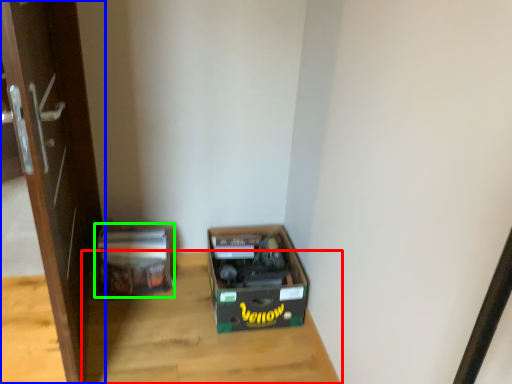
Question: Which object is positioned closest to table (highlighted by a red box)? Select from door (highlighted by a blue box) and cardboard box (highlighted by a green box).

Choices:
 (A) door
 (B) cardboard box

Answer: (B)